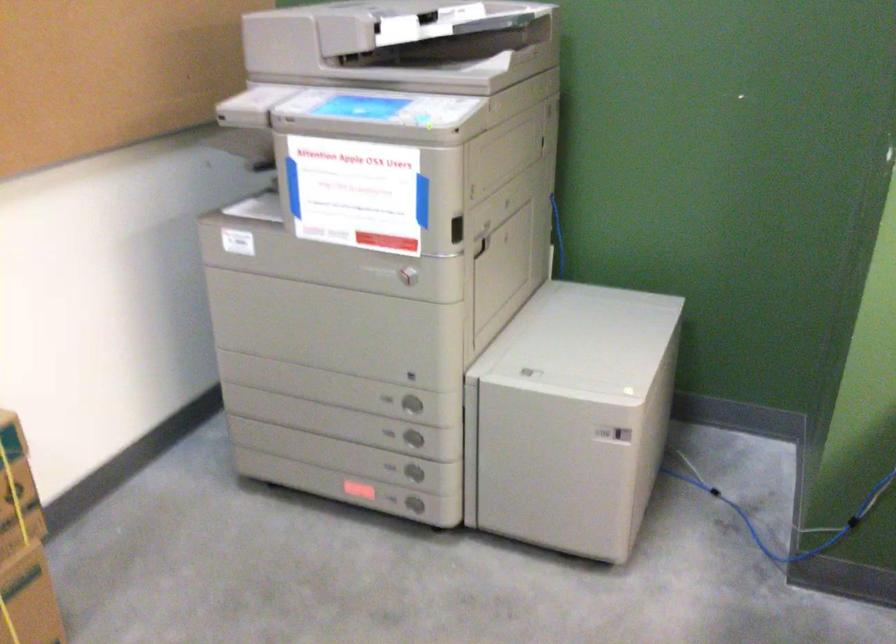
What do you see at coordinates (572, 418) in the screenshot?
I see `a copier side panel` at bounding box center [572, 418].